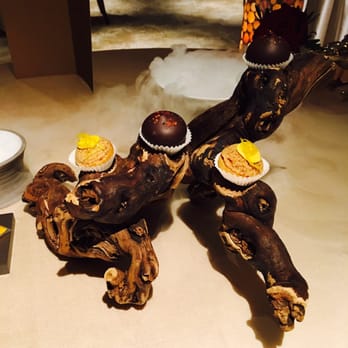
Locate an element on the screen. flooring behind the table is located at coordinates (153, 23).